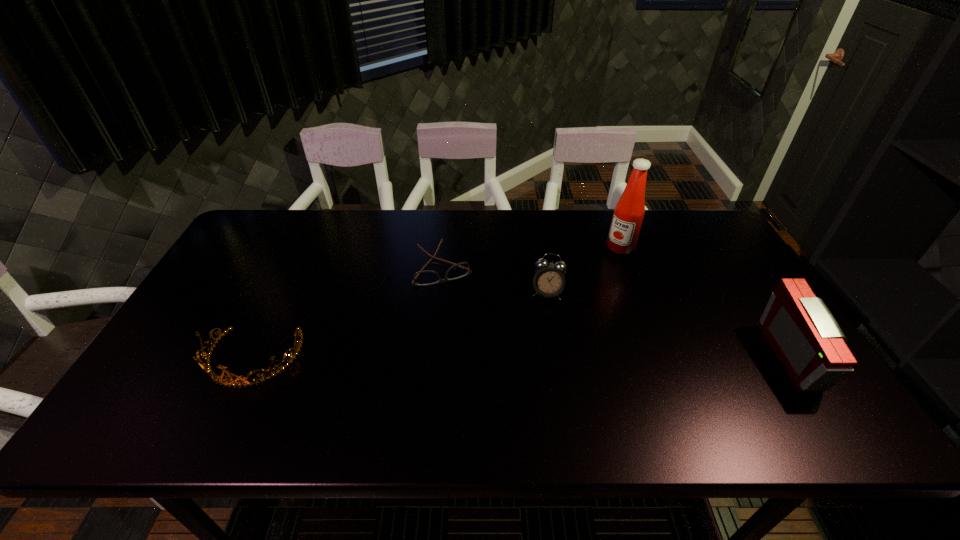
Where is `free space on the desktop that is between the fourth tallest object and the camera and is positioned on the face of the third object from right to left`? This screenshot has width=960, height=540. free space on the desktop that is between the fourth tallest object and the camera and is positioned on the face of the third object from right to left is located at coordinates (540, 358).

At what (x,y) coordinates should I click in order to perform the action: click on vacant space on the desktop that is between the second shortest object and the rightmost object and is positioned on the front-facing side of the shortest object. Please return your answer as a coordinate pair (x, y). Looking at the image, I should click on (479, 358).

Identify the location of free space on the desktop that is between the leftmost object and the camera and is positioned on the front-facing side of the tallest object. pyautogui.click(x=499, y=358).